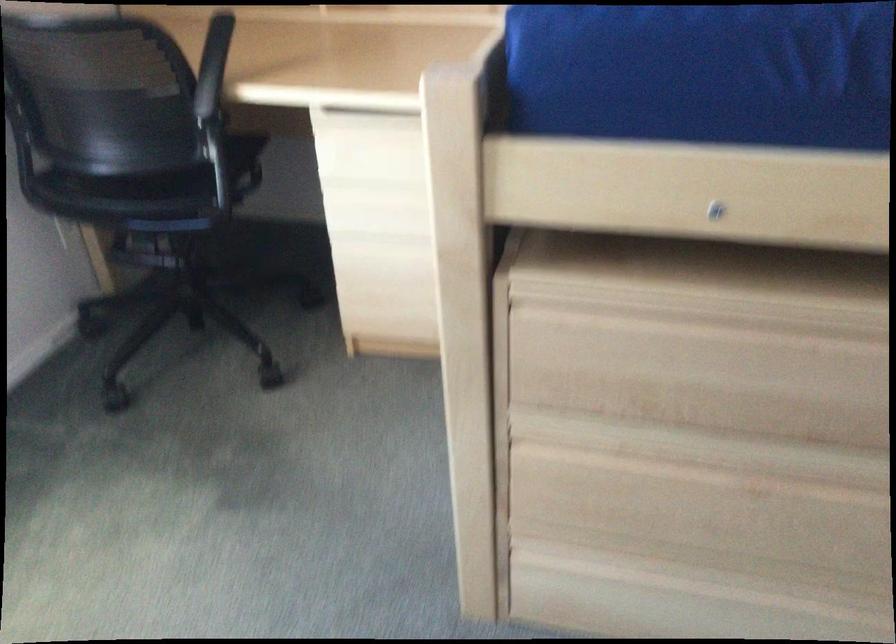
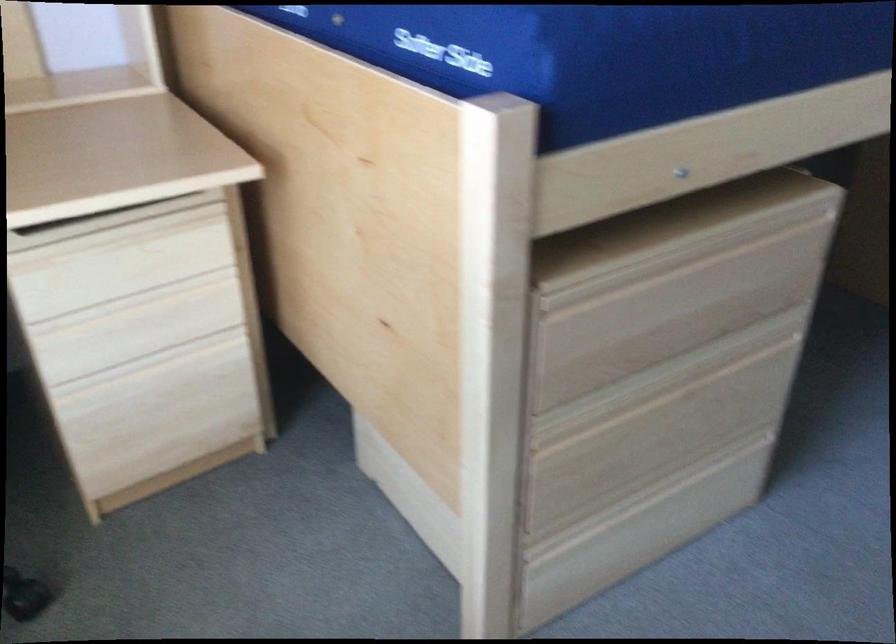
Find the pixel in the second image that matches point (741, 462) in the first image.

(673, 377)